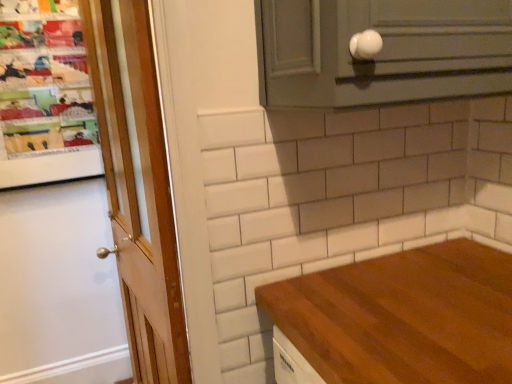
Question: In terms of size, does white glossy knob at upper right appear bigger or smaller than wooden door at left?

Choices:
 (A) big
 (B) small

Answer: (B)

Question: Would you say white glossy knob at upper right is to the left or to the right of wooden door at left in the picture?

Choices:
 (A) right
 (B) left

Answer: (A)

Question: Is white glossy knob at upper right wider or thinner than wooden door at left?

Choices:
 (A) wide
 (B) thin

Answer: (A)

Question: Considering the relative positions of wooden door at left and white glossy knob at upper right in the image provided, is wooden door at left to the left or to the right of white glossy knob at upper right?

Choices:
 (A) right
 (B) left

Answer: (B)

Question: Is wooden door at left wider or thinner than white glossy knob at upper right?

Choices:
 (A) thin
 (B) wide

Answer: (A)

Question: In terms of size, does wooden door at left appear bigger or smaller than white glossy knob at upper right?

Choices:
 (A) big
 (B) small

Answer: (A)

Question: Considering the positions of point (135, 218) and point (333, 18), is point (135, 218) closer or farther from the camera than point (333, 18)?

Choices:
 (A) closer
 (B) farther

Answer: (B)